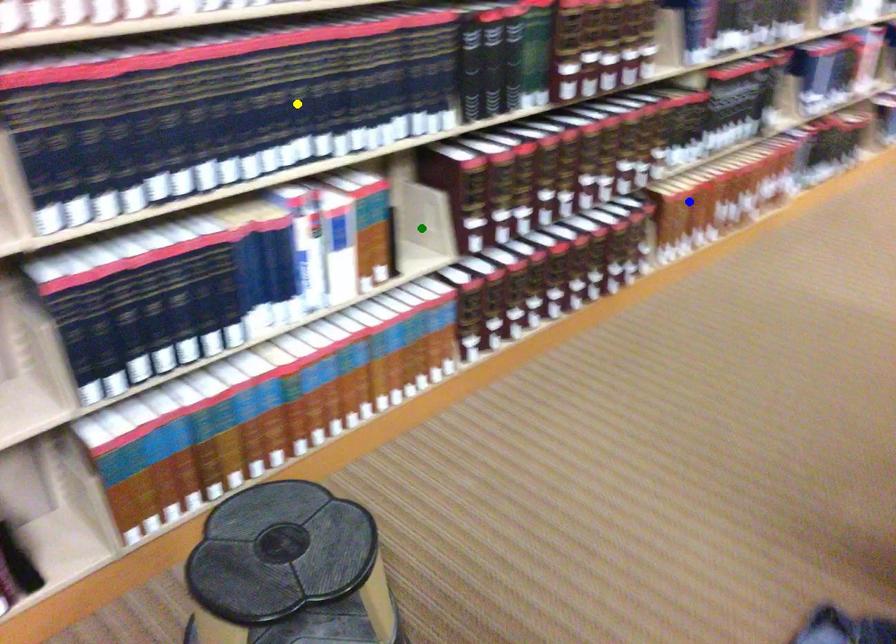
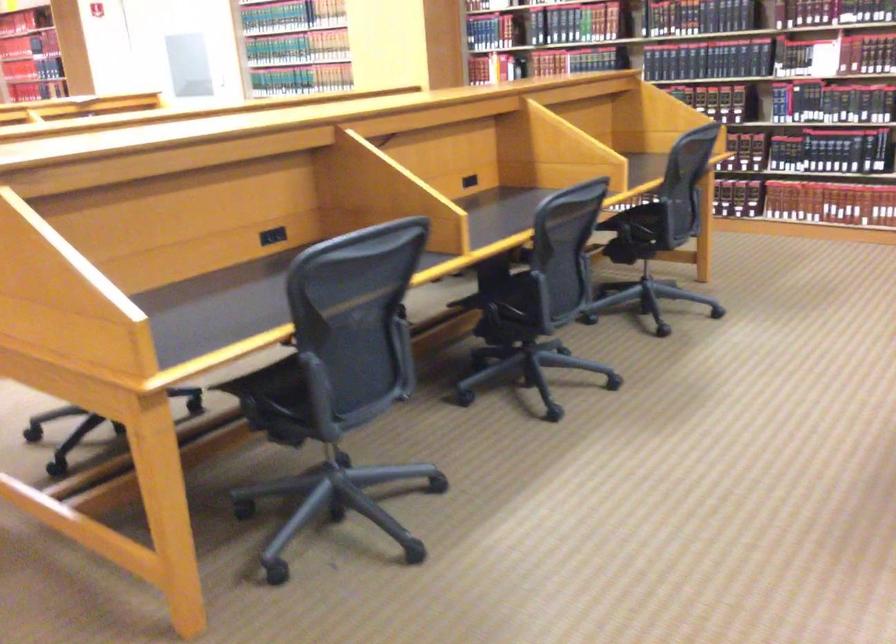
I am providing you with two images of the same scene from different viewpoints. Three points are marked in image1. Which point corresponds to a part or object that is occluded in image2?In image1, three points are marked. Which of them correspond to a part or object that is occluded in image2?Among the three points shown in image1, which one corresponds to a part or object that is no longer visible due to occlusion in image2?

Invisible in image2: yellow point, green point.